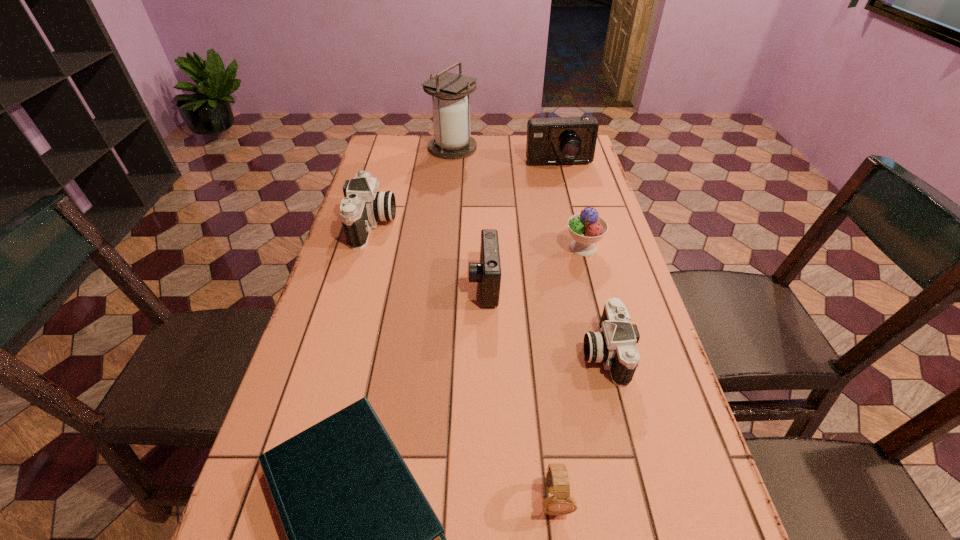
This screenshot has height=540, width=960. Identify the location of lantern present at the far edge. (451, 111).

Identify the location of camera that is at the far edge. This screenshot has width=960, height=540. (566, 140).

At what (x,y) coordinates should I click in order to perform the action: click on object positioned at the left edge. Please return your answer as a coordinate pair (x, y). The image size is (960, 540). Looking at the image, I should click on (364, 206).

This screenshot has width=960, height=540. Find the location of `icecream that is at the right edge`. icecream that is at the right edge is located at coordinates (586, 228).

At what (x,y) coordinates should I click in order to perform the action: click on object present at the far right corner. Please return your answer as a coordinate pair (x, y). The image size is (960, 540). Looking at the image, I should click on (566, 140).

Where is `blank area at the far edge`? Image resolution: width=960 pixels, height=540 pixels. blank area at the far edge is located at coordinates (476, 142).

This screenshot has height=540, width=960. Find the location of `blank area at the left edge`. blank area at the left edge is located at coordinates pyautogui.click(x=348, y=309).

In the image, there is a desktop. Identify the location of vacant space at the right edge. (599, 195).

At what (x,y) coordinates should I click in order to perform the action: click on free area in between the leftmost camera and the farthest camera. Please return your answer as a coordinate pair (x, y). Looking at the image, I should click on (466, 194).

Where is `free spot between the second nearest camera and the icecream`? The image size is (960, 540). free spot between the second nearest camera and the icecream is located at coordinates (534, 266).